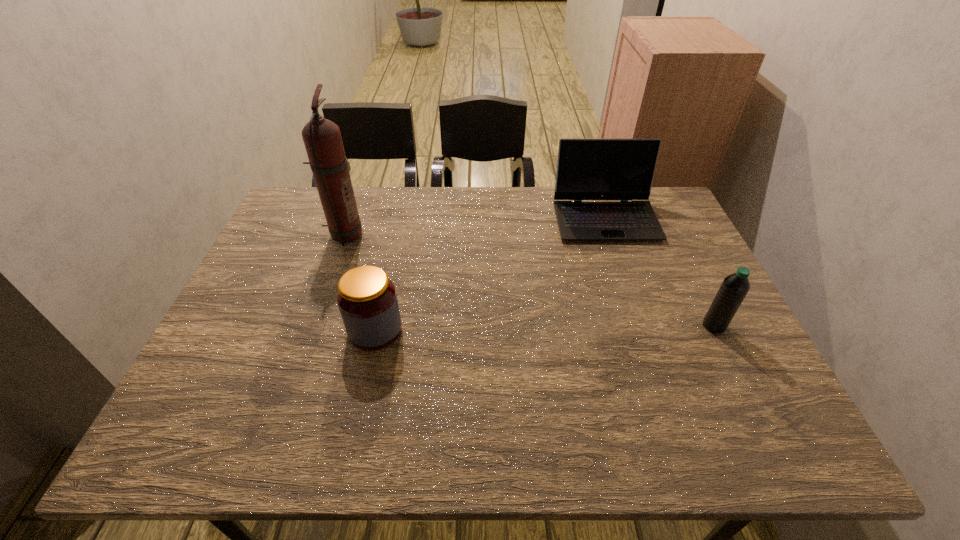
At what (x,y) coordinates should I click in order to perform the action: click on fire extinguisher. Please return your answer as a coordinate pair (x, y). Looking at the image, I should click on (322, 138).

This screenshot has width=960, height=540. Identify the location of the tallest object. (322, 138).

This screenshot has height=540, width=960. I want to click on laptop computer, so click(587, 169).

Locate an element on the screen. water bottle is located at coordinates (734, 288).

Image resolution: width=960 pixels, height=540 pixels. I want to click on the third object from right to left, so click(x=366, y=297).

In order to click on vacant space located 0.400m on the side of the fire extinguisher with the label and nozzle in this screenshot , I will do `click(494, 234)`.

The width and height of the screenshot is (960, 540). I want to click on vacant area situated on the screen of the laptop computer, so click(647, 343).

Find the location of a particular element. free location located 0.050m on the front of the water bottle is located at coordinates (727, 351).

The height and width of the screenshot is (540, 960). What are the coordinates of `vacant space located 0.120m on the left of the jar` in the screenshot? It's located at (300, 330).

The width and height of the screenshot is (960, 540). What are the coordinates of `fire extinguisher at the far edge` in the screenshot? It's located at (322, 138).